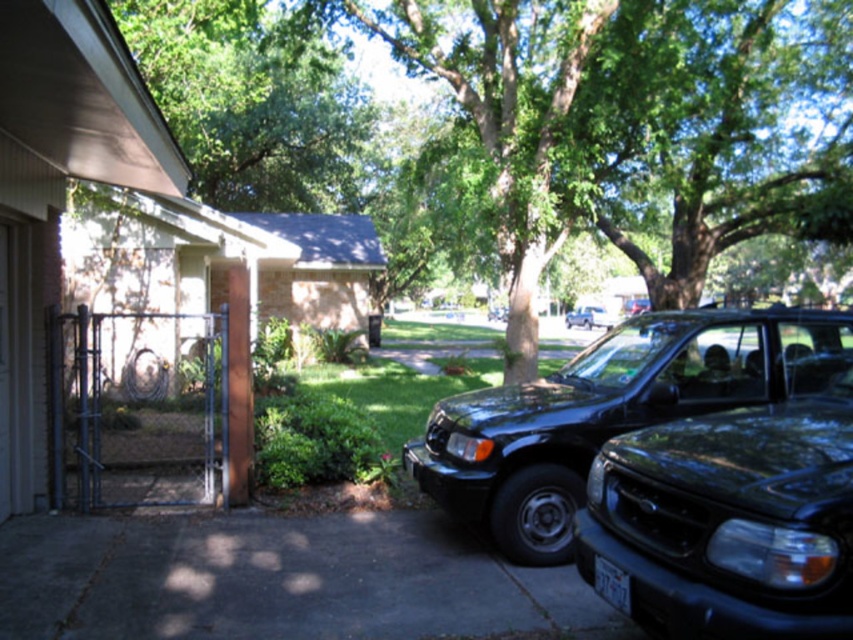
You are a delivery person trying to park your van between the two vehicles in the driveway. The glossy black suv at center and the shiny black suv at center are parked side by side. Which vehicle should you move to create space for your van?

The glossy black suv at center is smaller than the shiny black suv at center. Moving the smaller glossy black suv at center would create more space for your van.

You are a delivery person trying to read the license plate of the shiny black suv at center. The white plastic license plate at center is partially obscured by a bush. Can you determine if the license plate is large enough to read from where you are standing?

The white plastic license plate at center is smaller than the shiny black suv at center, but since license plates are typically designed to be readable from a reasonable distance, it might still be possible to read the license plate if you move closer or use a device with zoom capability.

You are a delivery person standing at the entrance of the driveway. You need to read the license plate number on the white plastic license plate at center to confirm the delivery address. Can you read the license plate number clearly from where you are?

The white plastic license plate at center is 10.69 feet away from the camera, so yes, you can read the license plate number clearly from that distance.